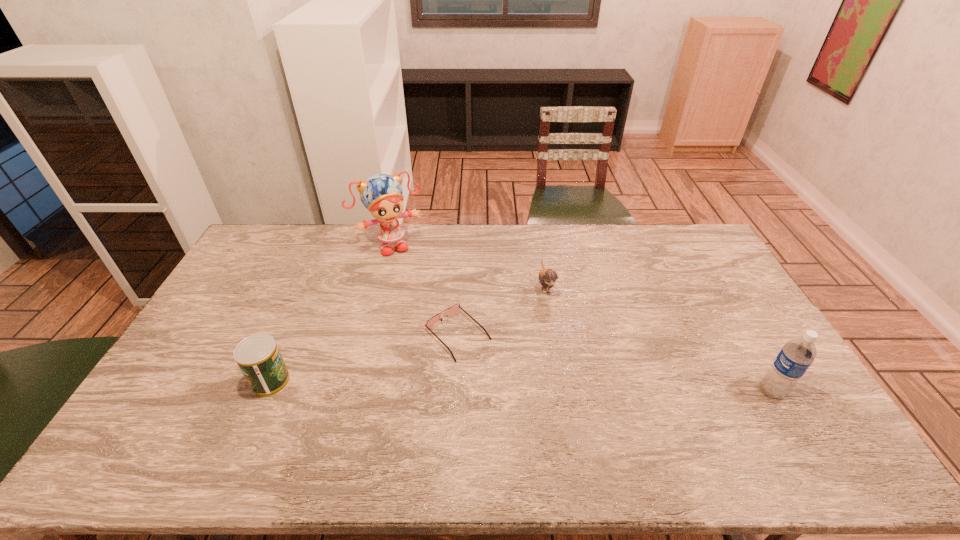
The image size is (960, 540). I want to click on vacant region between the farthest object and the fourth shortest object, so click(581, 318).

Locate an element on the screen. The height and width of the screenshot is (540, 960). free space between the second farthest object and the third object from left to right is located at coordinates (502, 310).

Image resolution: width=960 pixels, height=540 pixels. I want to click on vacant area that lies between the second object from right to left and the water bottle, so (x=659, y=339).

Where is `vacant point located between the kitten and the second tallest object`? Image resolution: width=960 pixels, height=540 pixels. vacant point located between the kitten and the second tallest object is located at coordinates (659, 339).

You are a GUI agent. You are given a task and a screenshot of the screen. Output one action in this format:
    pyautogui.click(x=<x>, y=<y>)
    Task: Click on the free spot between the leftmost object and the second farthest object
    The image size is (960, 540).
    Given the screenshot: What is the action you would take?
    pyautogui.click(x=408, y=334)

Where is `free point between the kitten and the doll`? This screenshot has height=540, width=960. free point between the kitten and the doll is located at coordinates [x=468, y=265].

The image size is (960, 540). I want to click on free space between the fourth tallest object and the third object from right to left, so click(502, 310).

Identify the location of free space between the doll and the second shortest object. (468, 265).

Locate an element on the screen. The image size is (960, 540). vacant area that lies between the third object from left to right and the second object from left to right is located at coordinates (424, 290).

Identify the location of object that is the closest to the can. (452, 310).